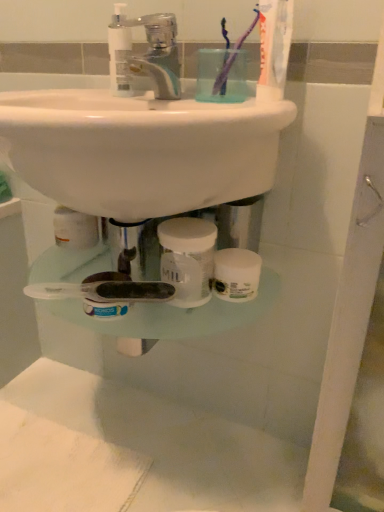
Question: Which direction should I rotate to look at white opaque jar at center, the 1th mouthwash positioned from the right?

Choices:
 (A) right
 (B) left

Answer: (B)

Question: Is clear plastic faucet at upper center taller than white opaque jar at center, which is the second mouthwash in left-to-right order?

Choices:
 (A) yes
 (B) no

Answer: (A)

Question: Is clear plastic faucet at upper center facing away from white opaque jar at center, positioned as the second mouthwash in top-to-bottom order?

Choices:
 (A) yes
 (B) no

Answer: (B)

Question: Is clear plastic faucet at upper center not near white opaque jar at center, which is the second mouthwash in left-to-right order?

Choices:
 (A) yes
 (B) no

Answer: (B)

Question: From the image's perspective, is clear plastic faucet at upper center located beneath white opaque jar at center, which is the second mouthwash in left-to-right order?

Choices:
 (A) yes
 (B) no

Answer: (B)

Question: From a real-world perspective, is clear plastic faucet at upper center on white opaque jar at center, the 1th mouthwash positioned from the right?

Choices:
 (A) yes
 (B) no

Answer: (A)

Question: Is clear plastic faucet at upper center behind white opaque jar at center, positioned as the second mouthwash in top-to-bottom order?

Choices:
 (A) yes
 (B) no

Answer: (B)

Question: From the image's perspective, is purple plastic toothbrush at upper center, placed as the 1th toothbrush when sorted from left to right, located above clear plastic faucet at upper center?

Choices:
 (A) yes
 (B) no

Answer: (A)

Question: Is clear plastic faucet at upper center at the back of purple plastic toothbrush at upper center, the second toothbrush viewed from the right?

Choices:
 (A) no
 (B) yes

Answer: (A)

Question: Can you confirm if purple plastic toothbrush at upper center, the second toothbrush viewed from the right, is taller than clear plastic faucet at upper center?

Choices:
 (A) yes
 (B) no

Answer: (A)

Question: Is purple plastic toothbrush at upper center, the second toothbrush viewed from the right, aimed at clear plastic faucet at upper center?

Choices:
 (A) no
 (B) yes

Answer: (A)

Question: From the image's perspective, is purple plastic toothbrush at upper center, the second toothbrush viewed from the right, beneath clear plastic faucet at upper center?

Choices:
 (A) yes
 (B) no

Answer: (B)

Question: Can you confirm if purple plastic toothbrush at upper center, placed as the 1th toothbrush when sorted from left to right, is bigger than clear plastic faucet at upper center?

Choices:
 (A) yes
 (B) no

Answer: (B)

Question: Is clear plastic faucet at upper center looking in the opposite direction of transparent plastic mouthwash at upper center, which is the 1th mouthwash in left-to-right order?

Choices:
 (A) no
 (B) yes

Answer: (A)